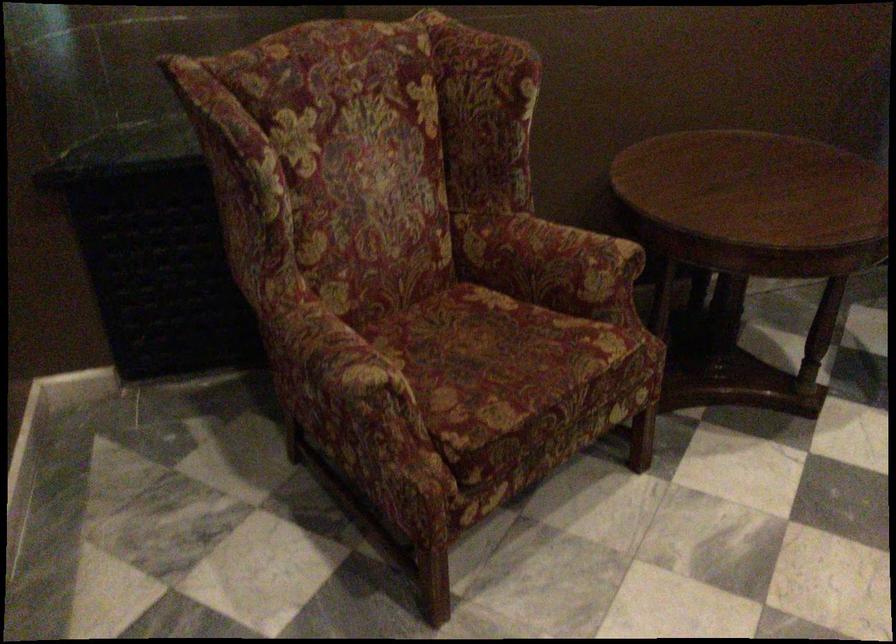
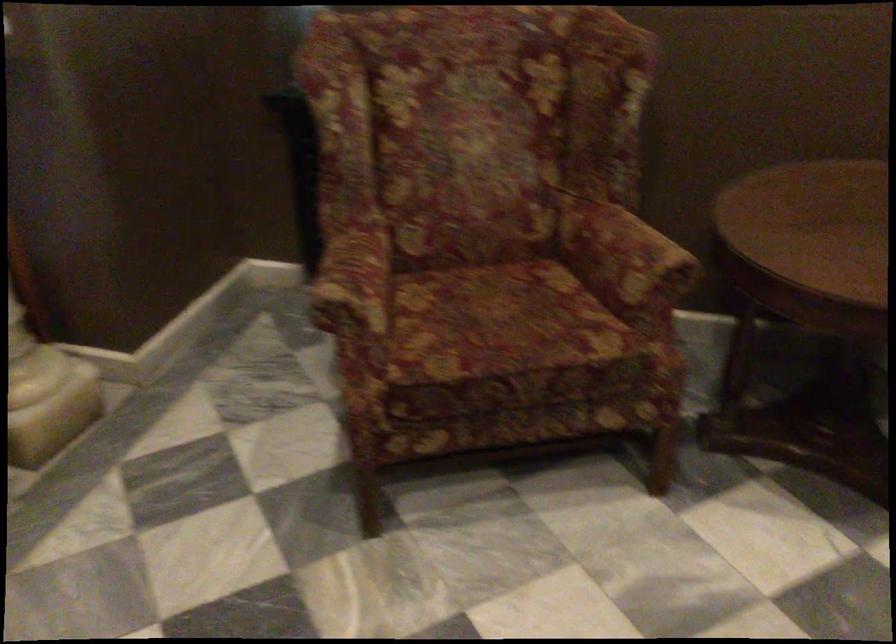
Locate, in the second image, the point that corresponds to pixel 573 260 in the first image.

(624, 258)